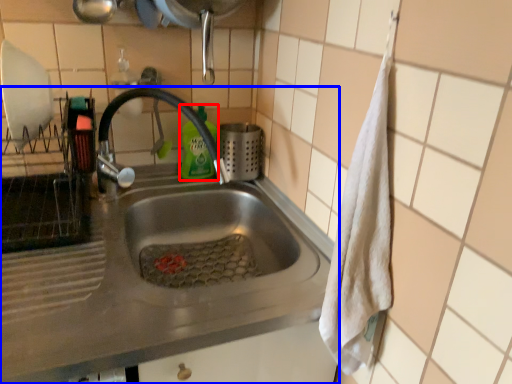
Question: Which point is further to the camera, cleaning product (highlighted by a red box) or sink (highlighted by a blue box)?

Choices:
 (A) cleaning product
 (B) sink

Answer: (A)